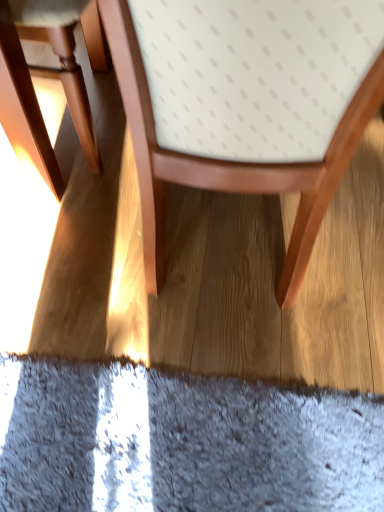
Question: Which direction should I rotate to look at wooden chair at center, the 1th chair when ordered from right to left, — up or down?

Choices:
 (A) up
 (B) down

Answer: (A)

Question: From a real-world perspective, is matte wood chair at left, which is the 1th chair in left-to-right order, on wooden chair at center, the 1th chair when ordered from right to left?

Choices:
 (A) yes
 (B) no

Answer: (B)

Question: Does matte wood chair at left, placed as the second chair when sorted from right to left, contain wooden chair at center, the 1th chair when ordered from right to left?

Choices:
 (A) yes
 (B) no

Answer: (B)

Question: Considering the relative sizes of matte wood chair at left, placed as the second chair when sorted from right to left, and wooden chair at center, the second chair in the left-to-right sequence, in the image provided, is matte wood chair at left, placed as the second chair when sorted from right to left, smaller than wooden chair at center, the second chair in the left-to-right sequence,?

Choices:
 (A) no
 (B) yes

Answer: (B)

Question: From the image's perspective, is matte wood chair at left, which is the 1th chair in left-to-right order, over wooden chair at center, the 1th chair when ordered from right to left?

Choices:
 (A) yes
 (B) no

Answer: (A)

Question: Does matte wood chair at left, placed as the second chair when sorted from right to left, have a lesser width compared to wooden chair at center, the 1th chair when ordered from right to left?

Choices:
 (A) no
 (B) yes

Answer: (B)

Question: Are matte wood chair at left, which is the 1th chair in left-to-right order, and wooden chair at center, the 1th chair when ordered from right to left, far apart?

Choices:
 (A) no
 (B) yes

Answer: (A)

Question: Considering the relative positions of wooden chair at center, the second chair in the left-to-right sequence, and matte wood chair at left, which is the 1th chair in left-to-right order, in the image provided, is wooden chair at center, the second chair in the left-to-right sequence, behind matte wood chair at left, which is the 1th chair in left-to-right order,?

Choices:
 (A) no
 (B) yes

Answer: (A)

Question: Could you tell me if wooden chair at center, the second chair in the left-to-right sequence, is facing matte wood chair at left, placed as the second chair when sorted from right to left?

Choices:
 (A) no
 (B) yes

Answer: (A)

Question: Does wooden chair at center, the second chair in the left-to-right sequence, have a larger size compared to matte wood chair at left, placed as the second chair when sorted from right to left?

Choices:
 (A) no
 (B) yes

Answer: (B)

Question: Is wooden chair at center, the second chair in the left-to-right sequence, positioned in front of matte wood chair at left, placed as the second chair when sorted from right to left?

Choices:
 (A) no
 (B) yes

Answer: (B)

Question: Can you confirm if wooden chair at center, the second chair in the left-to-right sequence, is taller than matte wood chair at left, which is the 1th chair in left-to-right order?

Choices:
 (A) yes
 (B) no

Answer: (A)

Question: Is wooden chair at center, the 1th chair when ordered from right to left, to the right of matte wood chair at left, which is the 1th chair in left-to-right order, from the viewer's perspective?

Choices:
 (A) no
 (B) yes

Answer: (B)

Question: Looking at the image, does matte wood chair at left, placed as the second chair when sorted from right to left, seem bigger or smaller compared to wooden chair at center, the 1th chair when ordered from right to left?

Choices:
 (A) big
 (B) small

Answer: (B)